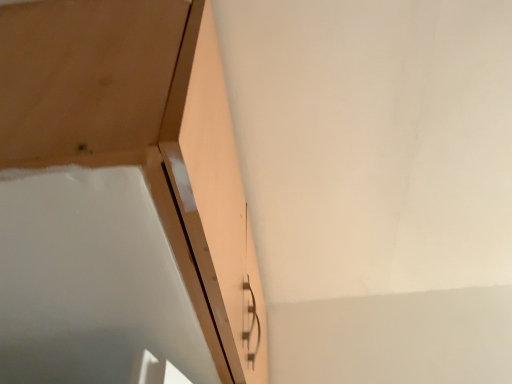
Identify the location of matte wood door at upper left. The image size is (512, 384). (144, 139).

Based on the photo, measure the distance between matte wood door at upper left and camera.

14.65 inches.

What do you see at coordinates (144, 139) in the screenshot? I see `matte wood door at upper left` at bounding box center [144, 139].

Find the location of `matte wood door at upper left`. matte wood door at upper left is located at coordinates (144, 139).